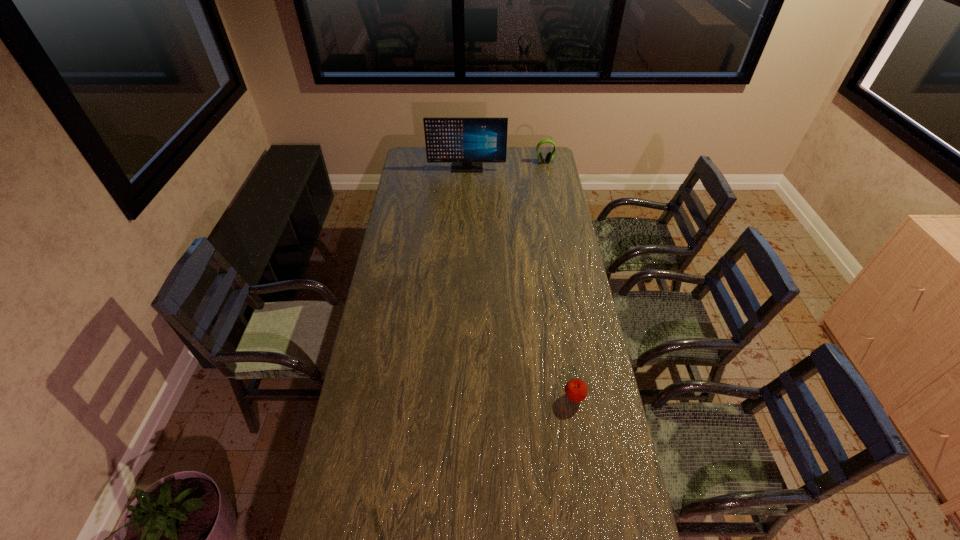
Identify the location of free point between the headset and the apple. The width and height of the screenshot is (960, 540). (560, 280).

Locate an element on the screen. empty location between the nearest object and the tallest object is located at coordinates (520, 282).

Find the location of `empty space between the computer monitor and the shortest object`. empty space between the computer monitor and the shortest object is located at coordinates (520, 282).

You are a GUI agent. You are given a task and a screenshot of the screen. Output one action in this format:
    pyautogui.click(x=<x>, y=<y>)
    Task: Click on the vacant space in between the tallest object and the shortest object
    The height and width of the screenshot is (540, 960).
    Given the screenshot: What is the action you would take?
    pyautogui.click(x=520, y=282)

The image size is (960, 540). Find the location of `free space between the headset and the tallest object`. free space between the headset and the tallest object is located at coordinates (506, 165).

Select which object is the second closest to the computer monitor. Please provide its 2D coordinates. Your answer should be formatted as a tuple, i.e. [(x, y)], where the tuple contains the x and y coordinates of a point satisfying the conditions above.

[(576, 390)]

Select which object appears as the second closest to the second shortest object. Please provide its 2D coordinates. Your answer should be formatted as a tuple, i.e. [(x, y)], where the tuple contains the x and y coordinates of a point satisfying the conditions above.

[(576, 390)]

Where is `free point that satisfies the following two spatial constraints: 1. on the screen side of the shortest object; 2. on the right side of the tallest object`? The image size is (960, 540). free point that satisfies the following two spatial constraints: 1. on the screen side of the shortest object; 2. on the right side of the tallest object is located at coordinates tap(458, 397).